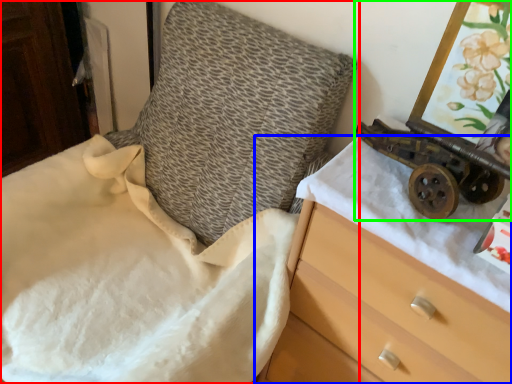
Question: Based on their relative distances, which object is nearer to furniture (highlighted by a red box)? Choose from chest of drawers (highlighted by a blue box) and toy (highlighted by a green box).

Choices:
 (A) chest of drawers
 (B) toy

Answer: (A)